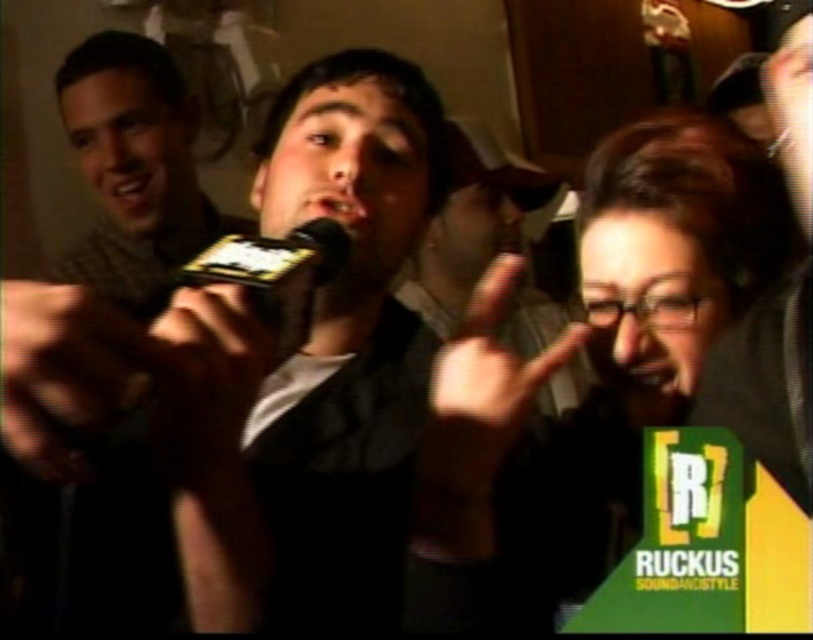
How far apart are matte black shirt at center and matte black finger at center?

matte black shirt at center and matte black finger at center are 5.27 inches apart.

Does matte black shirt at center appear over matte black finger at center?

Yes, matte black shirt at center is above matte black finger at center.

Where is `matte black shirt at center`? This screenshot has width=813, height=640. matte black shirt at center is located at coordinates (616, 301).

Is matte black microphone at center thinner than black matte microphone at center?

No.

Does matte black microphone at center appear under black matte microphone at center?

Actually, matte black microphone at center is above black matte microphone at center.

This screenshot has height=640, width=813. Find the location of `matte black microphone at center`. matte black microphone at center is located at coordinates (133, 168).

Where is `matte black shirt at center`? Image resolution: width=813 pixels, height=640 pixels. matte black shirt at center is located at coordinates (616, 301).

Is matte black shirt at center thinner than black plastic microphone at center?

No.

Which is behind, point (633, 198) or point (350, 250)?

The point (633, 198) is behind.

In order to click on matte black shirt at center in this screenshot , I will do `click(616, 301)`.